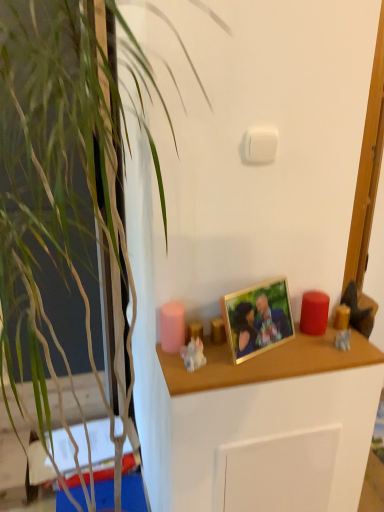
The width and height of the screenshot is (384, 512). I want to click on vacant space behind translucent plastic figurine at right, which is counted as the 2th toy, starting from the left, so click(336, 329).